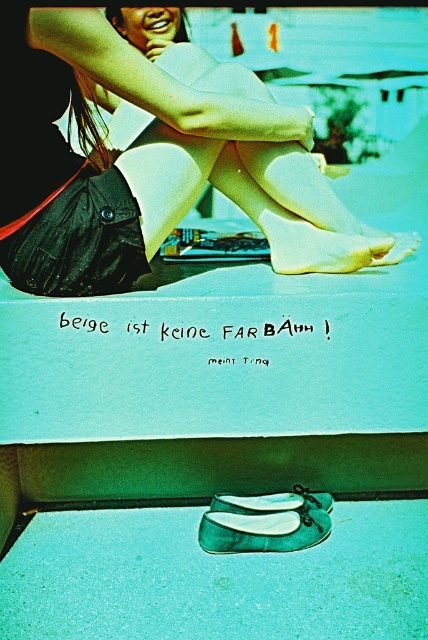
Who is higher up, green leather shoes at lower center or matte green shoe at lower center?

matte green shoe at lower center is higher up.

I want to click on green leather shoes at lower center, so click(265, 522).

Measure the distance between point (312, 520) and camera.

Point (312, 520) is 1.69 meters away from camera.

Find the location of a particular element. This screenshot has width=428, height=640. green leather shoes at lower center is located at coordinates (265, 522).

Is point (318, 221) positioned after point (297, 486)?

No, it is in front of (297, 486).

Does point (9, 260) come in front of point (273, 497)?

Yes.

This screenshot has width=428, height=640. Find the location of `matte black bag at lower left`. matte black bag at lower left is located at coordinates [149, 160].

From the picture: Can you confirm if matte black bag at lower left is positioned below green leather shoes at lower center?

Actually, matte black bag at lower left is above green leather shoes at lower center.

The image size is (428, 640). Identify the location of matte black bag at lower left. (149, 160).

Between point (234, 140) and point (199, 524), which one is positioned behind?

The point (234, 140) is behind.

Where is `matte black bag at lower left`? This screenshot has height=640, width=428. matte black bag at lower left is located at coordinates (149, 160).